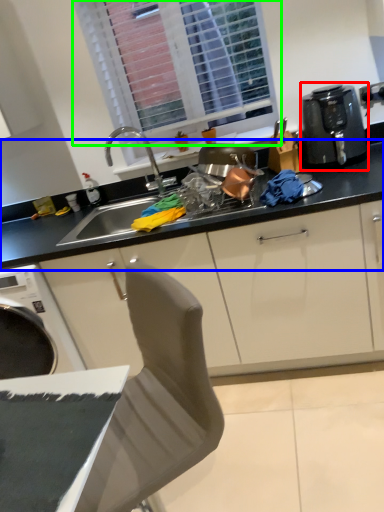
Question: Estimate the real-world distances between objects in this image. Which object is farther from kitchen appliance (highlighted by a red box), countertop (highlighted by a blue box) or window (highlighted by a green box)?

Choices:
 (A) countertop
 (B) window

Answer: (B)